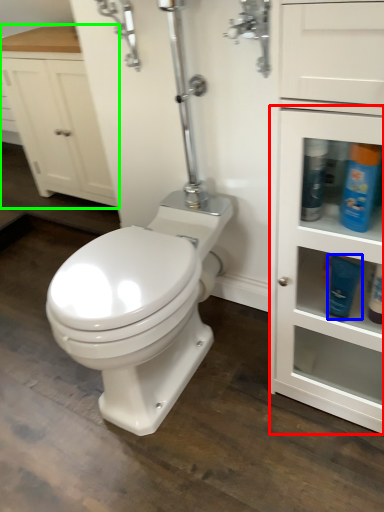
Question: Which object is positioned closest to cabinetry (highlighted by a red box)? Select from toiletry (highlighted by a blue box) and bathroom cabinet (highlighted by a green box).

Choices:
 (A) toiletry
 (B) bathroom cabinet

Answer: (A)